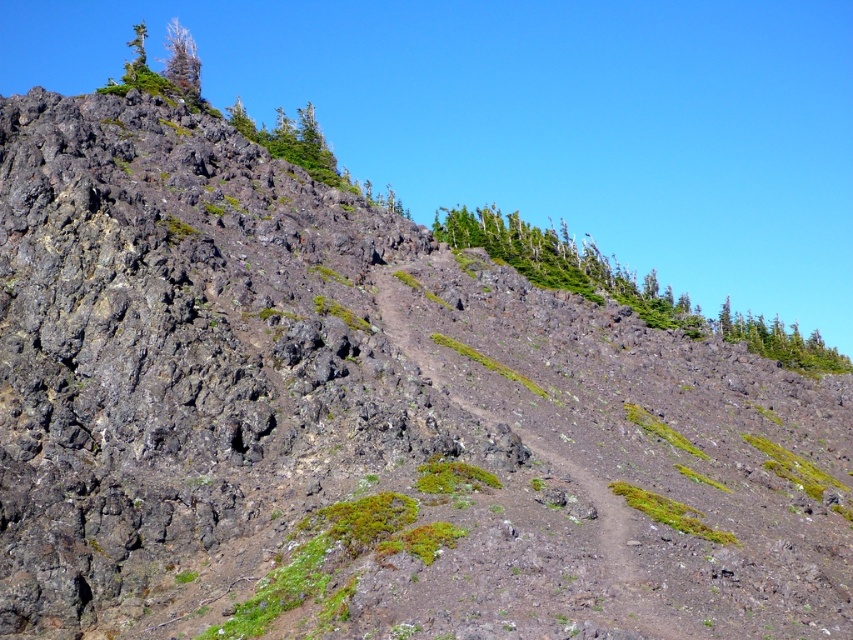
You are a hiker planning to follow the dirt path at center to reach a viewpoint. The green leafy trees at upper right are blocking your view. Can you see the viewpoint clearly from your current position?

The dirt path at center is behind green leafy trees at upper right, so the trees are between you and the path. Therefore, you cannot see the viewpoint clearly from your current position.

You are a hiker planning to reach the green leafy trees at upper right from the dirt path at center. Based on the scene, which direction should you head to ascend towards them?

The green leafy trees at upper right are above the dirt path at center, so you should head upwards from the dirt path at center towards the green leafy trees at upper right to reach them.